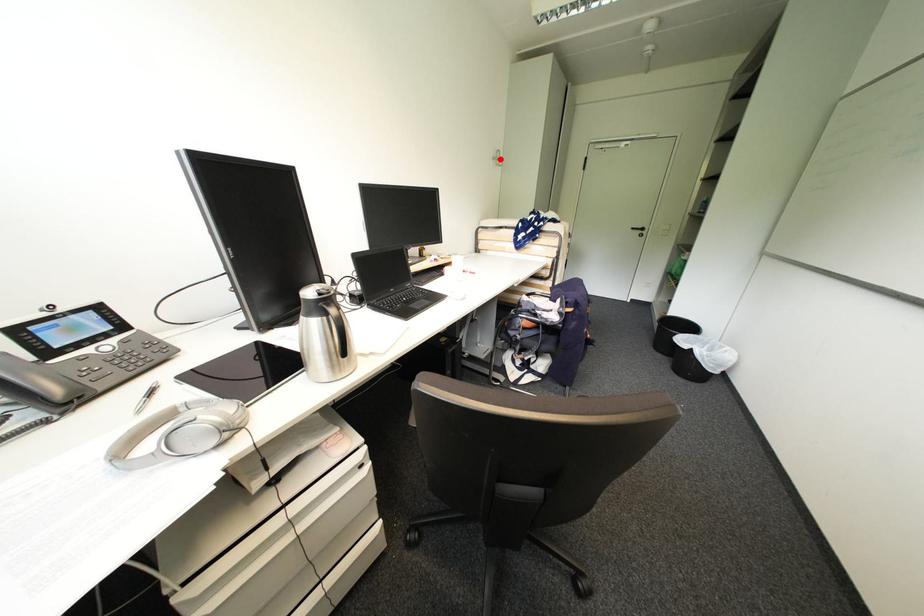
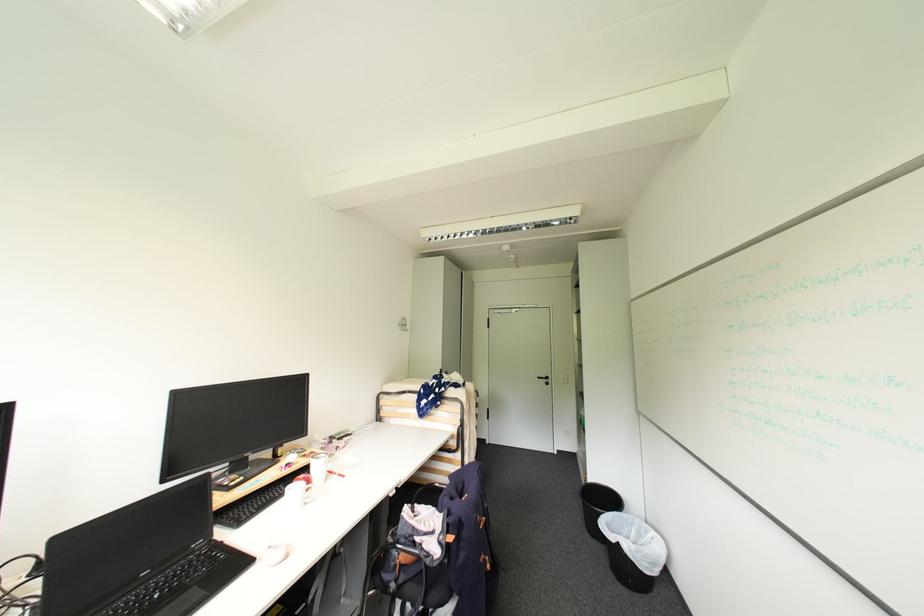
In the second image, find the point that corresponds to the highlighted location in the first image.

(406, 325)